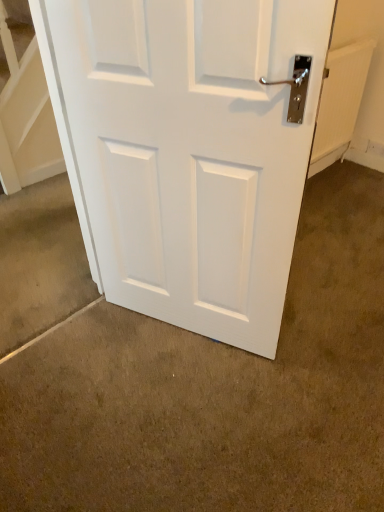
Locate an element on the screen. free spot to the right of white matte door at center is located at coordinates (322, 340).